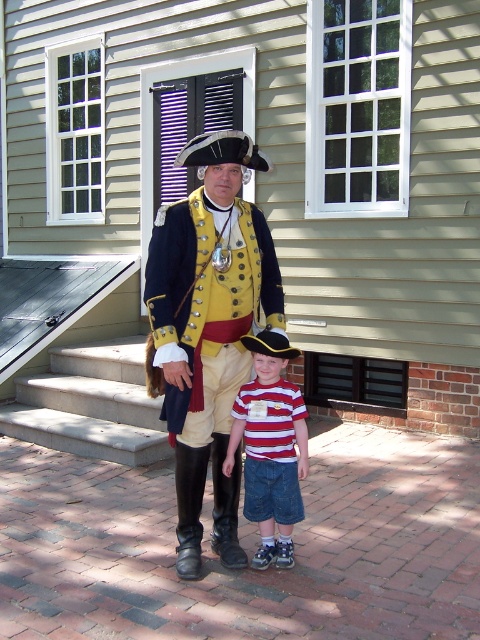
Question: Does concrete stairs at center appear on the right side of striped cotton shirt at center?

Choices:
 (A) no
 (B) yes

Answer: (A)

Question: Which object is closer to the camera taking this photo?

Choices:
 (A) concrete stairs at center
 (B) striped cotton shirt at center
 (C) matte gold uniform at center

Answer: (B)

Question: Is matte gold uniform at center below concrete stairs at center?

Choices:
 (A) no
 (B) yes

Answer: (A)

Question: Considering the real-world distances, which object is farthest from the striped cotton shirt at center?

Choices:
 (A) concrete stairs at center
 (B) matte gold uniform at center

Answer: (A)

Question: Which object appears closest to the camera in this image?

Choices:
 (A) striped cotton shirt at center
 (B) concrete stairs at center

Answer: (A)

Question: Does matte gold uniform at center have a greater width compared to striped cotton shirt at center?

Choices:
 (A) no
 (B) yes

Answer: (B)